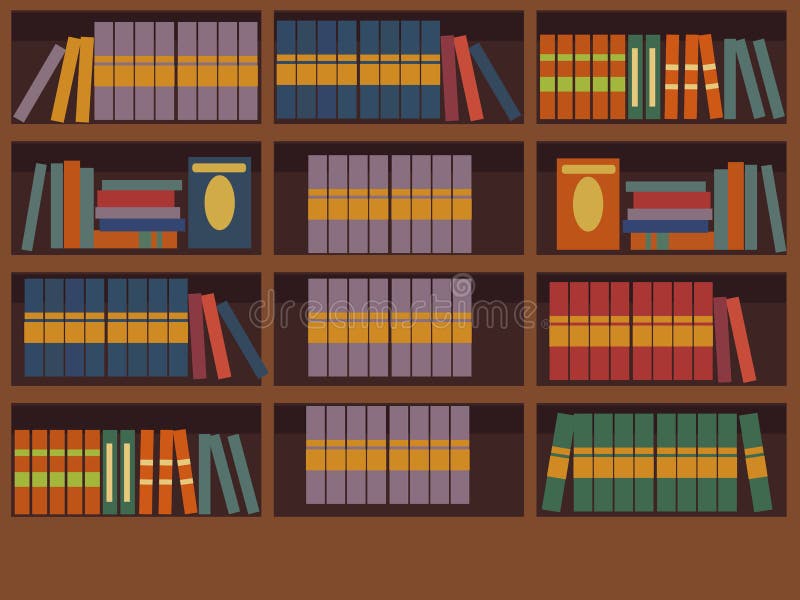
Where is `red books with yellow stripe`? This screenshot has width=800, height=600. red books with yellow stripe is located at coordinates (557, 366), (577, 369), (598, 373), (616, 371), (642, 371), (658, 372), (680, 371), (700, 369).